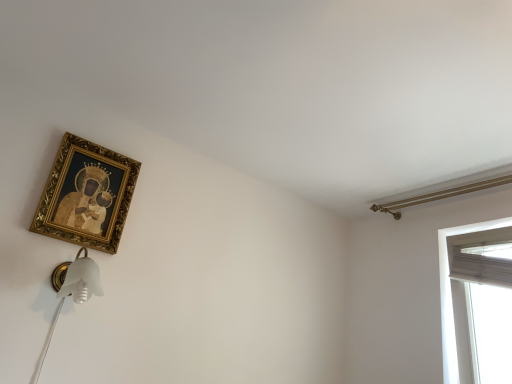
Question: Relative to gold ornate frame at upper left, is white sheer curtain at right in front or behind?

Choices:
 (A) front
 (B) behind

Answer: (B)

Question: Considering the relative positions of white sheer curtain at right and gold ornate frame at upper left in the image provided, is white sheer curtain at right to the left or to the right of gold ornate frame at upper left?

Choices:
 (A) left
 (B) right

Answer: (B)

Question: From the image's perspective, is white sheer curtain at right located above or below gold ornate frame at upper left?

Choices:
 (A) below
 (B) above

Answer: (A)

Question: From the image's perspective, is gold ornate frame at upper left located above or below white sheer curtain at right?

Choices:
 (A) below
 (B) above

Answer: (B)

Question: Relative to white sheer curtain at right, is gold ornate frame at upper left in front or behind?

Choices:
 (A) front
 (B) behind

Answer: (A)

Question: From a real-world perspective, is gold ornate frame at upper left above or below white sheer curtain at right?

Choices:
 (A) above
 (B) below

Answer: (A)

Question: Is gold ornate frame at upper left wider or thinner than white sheer curtain at right?

Choices:
 (A) wide
 (B) thin

Answer: (B)